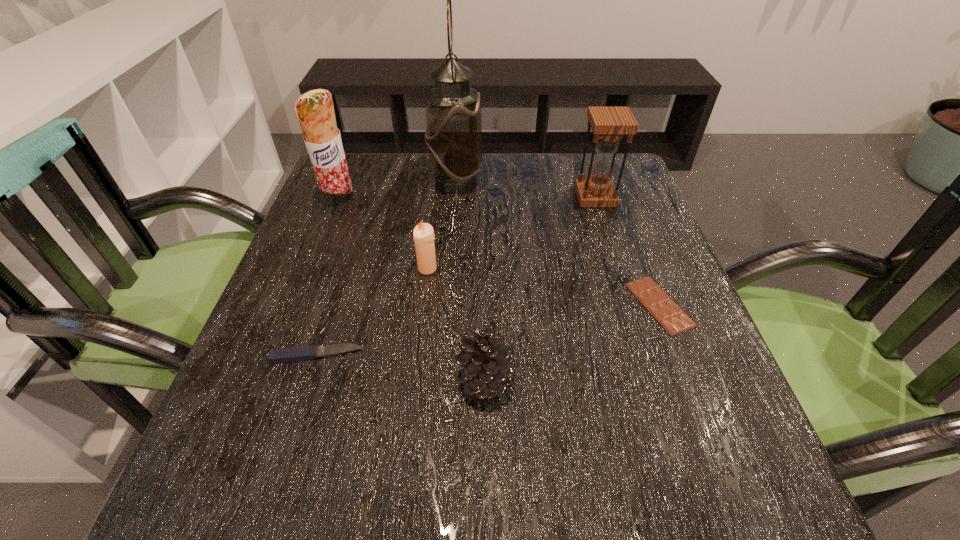
Locate an element on the screen. vacant point located between the shortest object and the burrito is located at coordinates (499, 252).

At what (x,y) coordinates should I click in order to perform the action: click on vacant area that lies between the second tallest object and the pinecone. Please return your answer as a coordinate pair (x, y). Looking at the image, I should click on (411, 289).

This screenshot has width=960, height=540. I want to click on empty space between the fourth farthest object and the third tallest object, so click(x=512, y=233).

In order to click on empty space between the sixth tallest object and the fourth farthest object in this screenshot , I will do `click(372, 312)`.

You are a GUI agent. You are given a task and a screenshot of the screen. Output one action in this format:
    pyautogui.click(x=<x>, y=<y>)
    Task: Click on the blank region between the fourth nearest object and the fifth farthest object
    The width and height of the screenshot is (960, 540).
    Given the screenshot: What is the action you would take?
    pyautogui.click(x=543, y=287)

This screenshot has width=960, height=540. What are the coordinates of `vacant point located between the oil lamp and the steak knife` in the screenshot? It's located at (386, 268).

The width and height of the screenshot is (960, 540). I want to click on blank region between the tallest object and the sixth tallest object, so click(386, 268).

Find the location of `vacant area that lies between the pinecone and the candle`. vacant area that lies between the pinecone and the candle is located at coordinates (456, 324).

Where is `free space between the candle and the steak knife`? free space between the candle and the steak knife is located at coordinates tap(372, 312).

Point out which object is positioned as the fifth nearest to the candle. Please provide its 2D coordinates. Your answer should be formatted as a tuple, i.e. [(x, y)], where the tuple contains the x and y coordinates of a point satisfying the conditions above.

[(670, 316)]